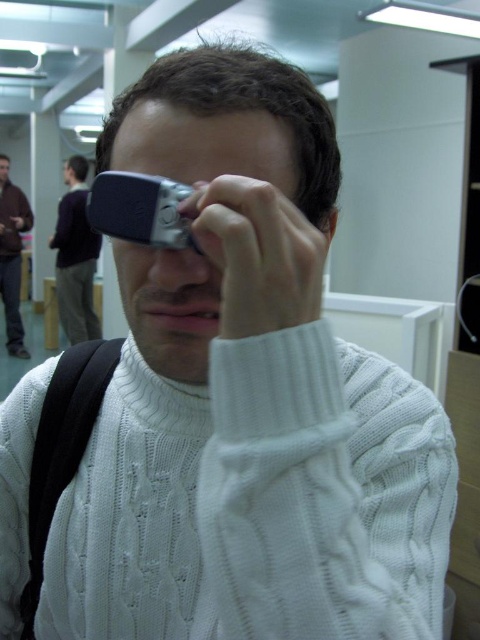
Question: Which of the following is the farthest from the observer?

Choices:
 (A) (57, 289)
 (B) (13, 268)

Answer: (B)

Question: Does dark purple sweater at upper left have a lesser width compared to brown leather jacket at left?

Choices:
 (A) yes
 (B) no

Answer: (B)

Question: Does dark purple sweater at upper left have a greater width compared to brown leather jacket at left?

Choices:
 (A) no
 (B) yes

Answer: (B)

Question: Which point is farther from the camera taking this photo?

Choices:
 (A) (10, 218)
 (B) (75, 216)

Answer: (A)

Question: Observing the image, what is the correct spatial positioning of dark purple sweater at upper left in reference to brown leather jacket at left?

Choices:
 (A) below
 (B) above

Answer: (A)

Question: Which of the following is the farthest from the observer?

Choices:
 (A) dark purple sweater at upper left
 (B) brown leather jacket at left

Answer: (B)